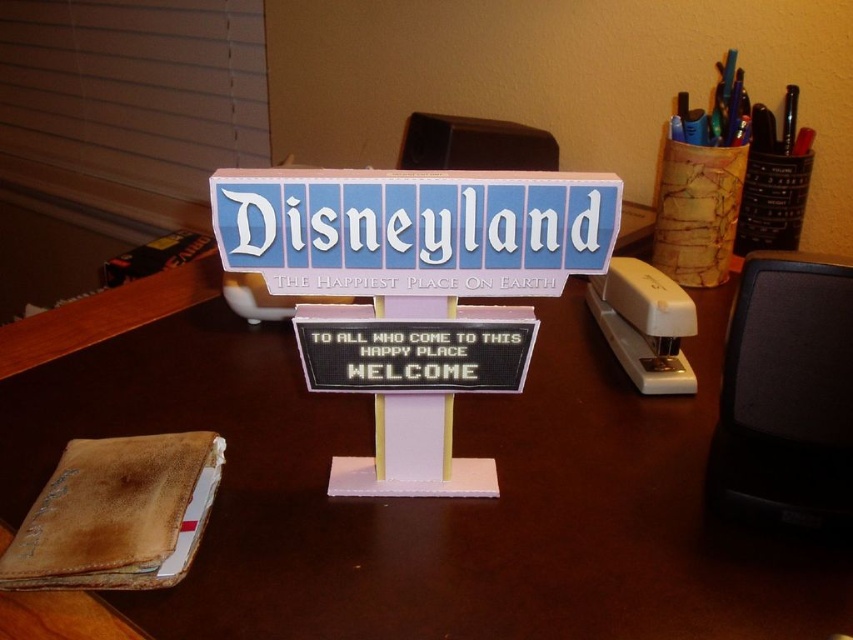
Does wooden desk at center have a lesser width compared to white plastic stapler at right?

No.

Between point (553, 488) and point (608, 285), which one is positioned in front?

Point (553, 488) is in front.

At what (x,y) coordinates should I click in order to perform the action: click on wooden desk at center. Please return your answer as a coordinate pair (x, y). The width and height of the screenshot is (853, 640). Looking at the image, I should click on (416, 499).

Who is more forward, (160,461) or (607,317)?

Positioned in front is point (160,461).

Is leather wallet at lower left taller than white plastic stapler at right?

No, leather wallet at lower left is not taller than white plastic stapler at right.

Which is behind, point (158, 488) or point (619, 291)?

Point (619, 291)

Find the location of a particular element. leather wallet at lower left is located at coordinates (117, 513).

Consider the image. Is blue plastic disneyland sign at center taller than white plastic stapler at right?

No.

Is blue plastic disneyland sign at center wider than white plastic stapler at right?

Correct, the width of blue plastic disneyland sign at center exceeds that of white plastic stapler at right.

Locate an element on the screen. The image size is (853, 640). blue plastic disneyland sign at center is located at coordinates (415, 228).

Locate an element on the screen. This screenshot has height=640, width=853. blue plastic disneyland sign at center is located at coordinates (415, 228).